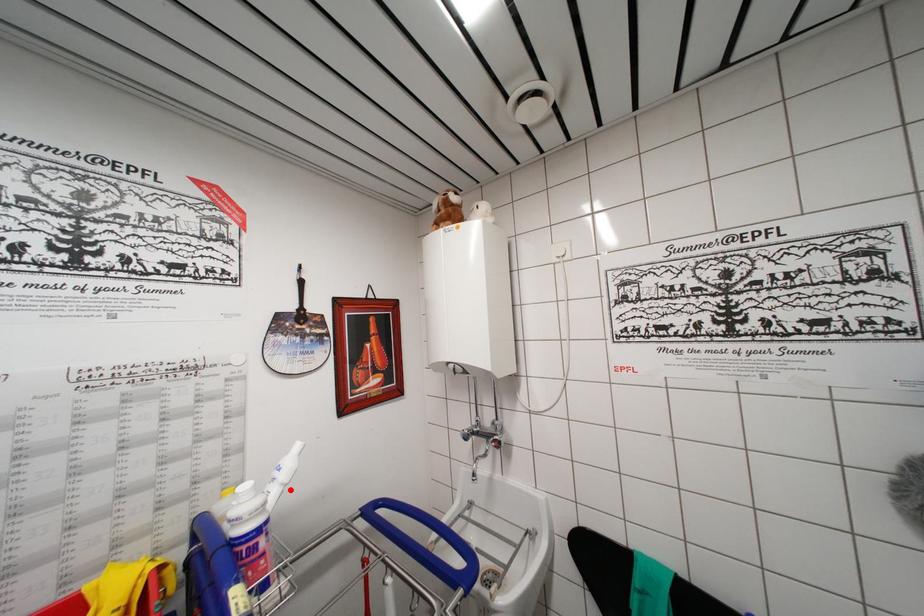
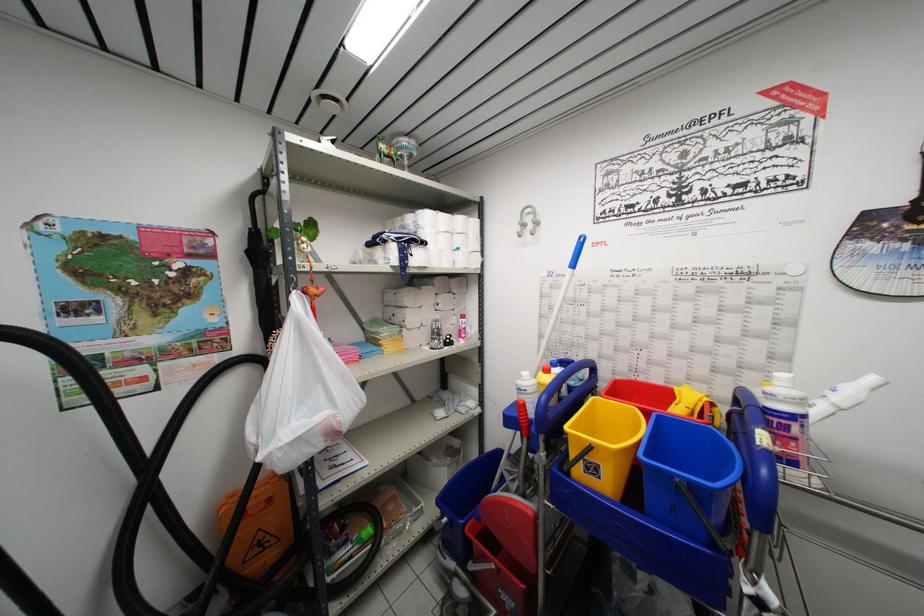
Question: I am providing you with two images of the same scene from different viewpoints. In image1, a red point is highlighted. Considering the same 3D point in image2, which of the following is correct?

Choices:
 (A) It is closer
 (B) It is farther

Answer: (A)